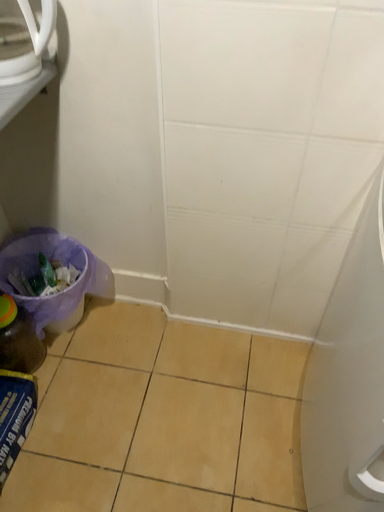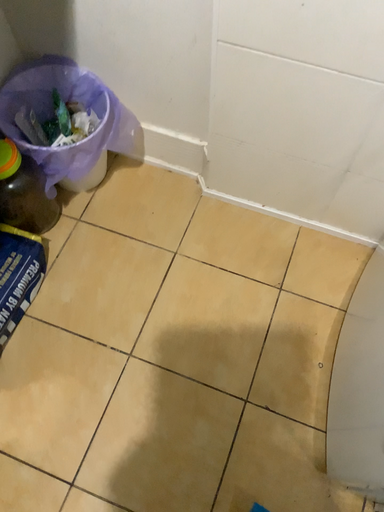
Question: Which way did the camera rotate in the video?

Choices:
 (A) rotated downward
 (B) rotated upward

Answer: (A)